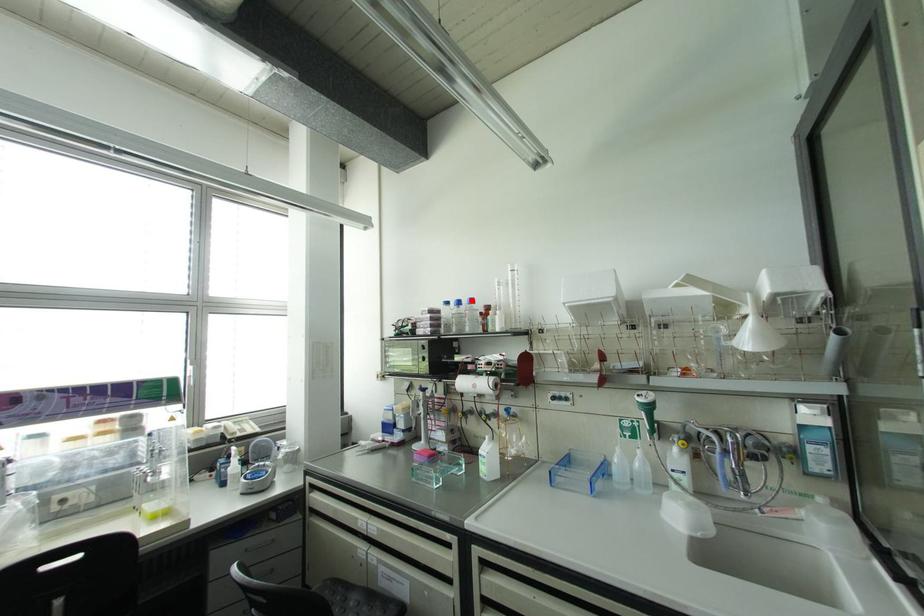
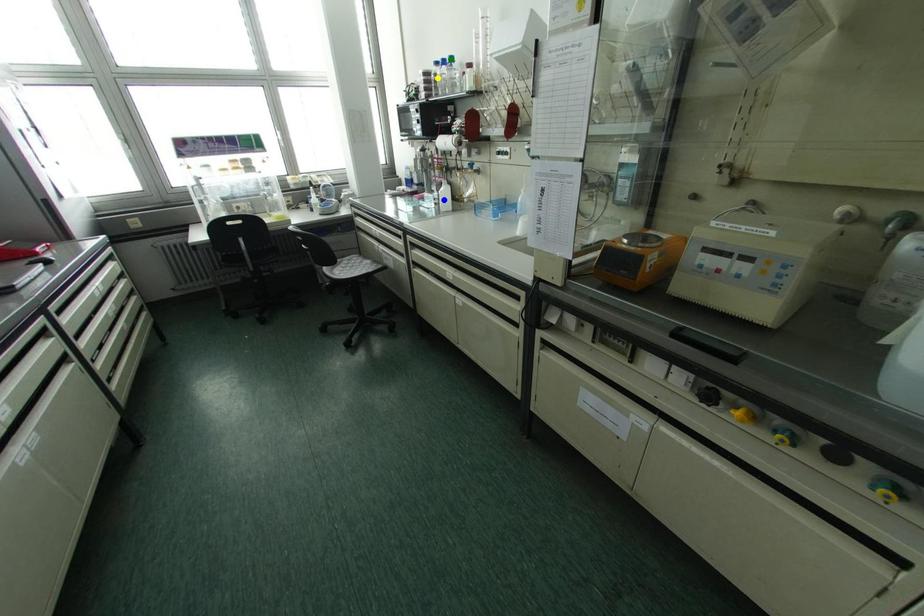
Question: I am providing you with two images of the same scene from different viewpoints. A red point is marked on the first image. You are given multiple points on the second image. In image 2, which mark is for the same physical point as the one in image 1?

Choices:
 (A) green point
 (B) yellow point
 (C) blue point

Answer: (A)